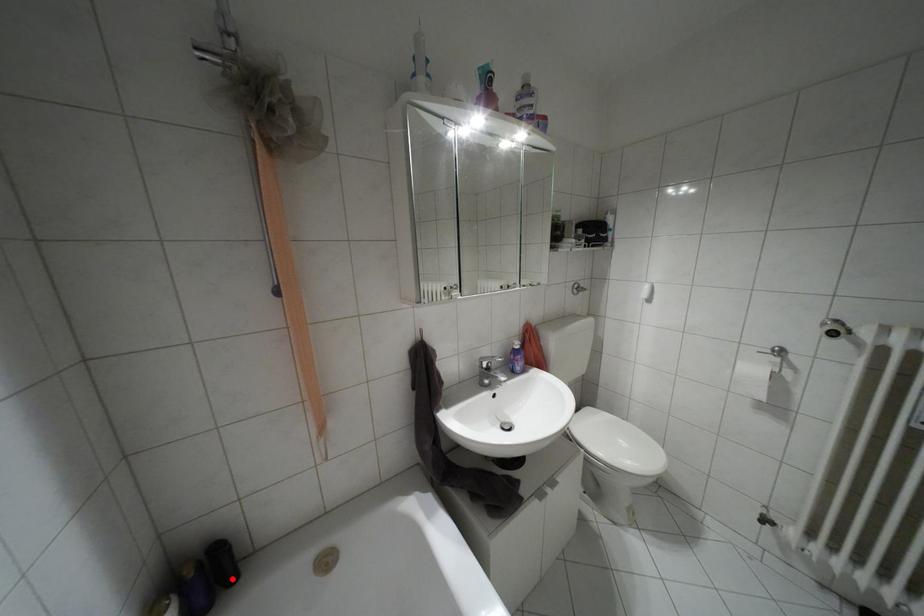
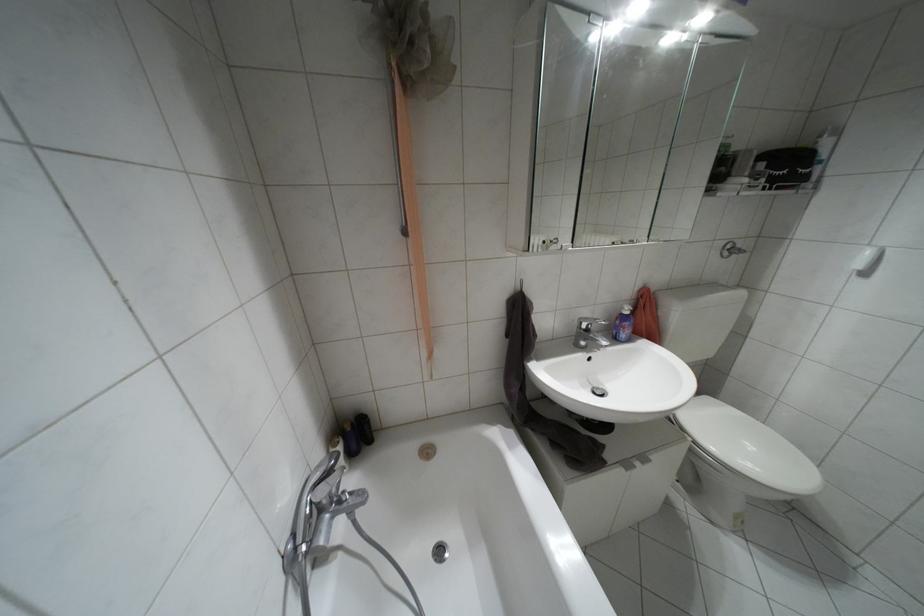
The point at the highlighted location is marked in the first image. Where is the corresponding point in the second image?

(370, 440)